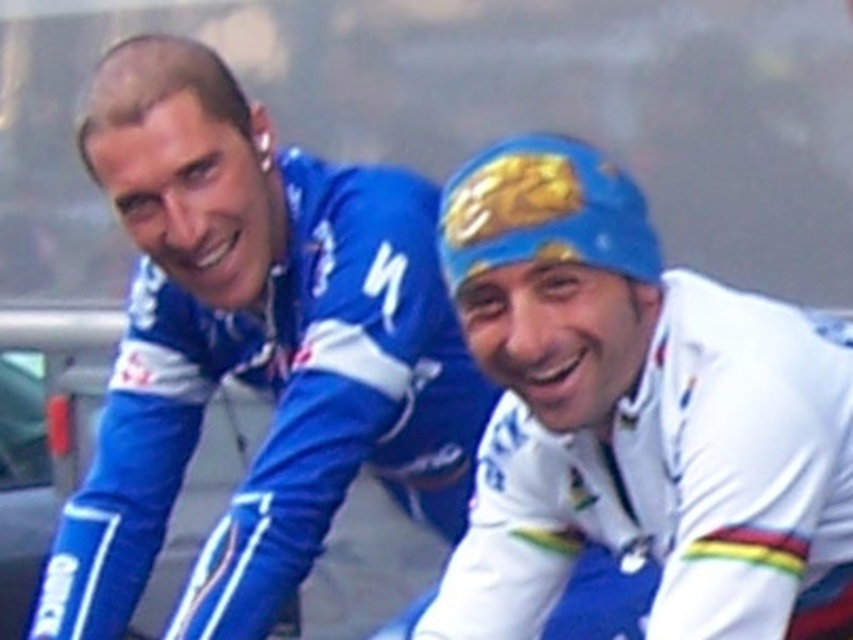
Consider the image. Is matte blue jersey at upper left taller than white glossy jersey at center?

Correct, matte blue jersey at upper left is much taller as white glossy jersey at center.

Does matte blue jersey at upper left have a larger size compared to white glossy jersey at center?

Yes, matte blue jersey at upper left is bigger than white glossy jersey at center.

Where is `matte blue jersey at upper left`? The height and width of the screenshot is (640, 853). matte blue jersey at upper left is located at coordinates tap(253, 348).